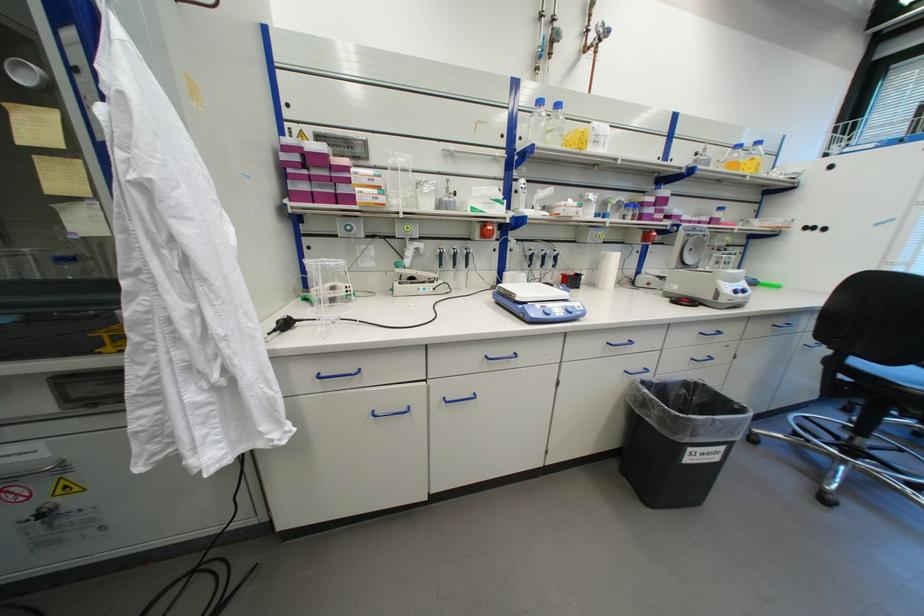
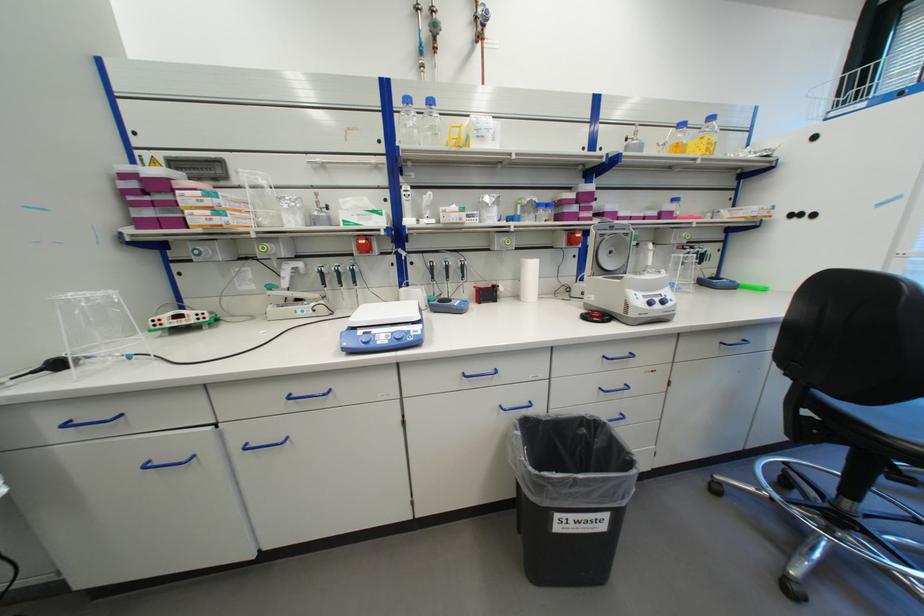
Find the pixel in the second image that matches [494,358] in the first image.

(298, 395)